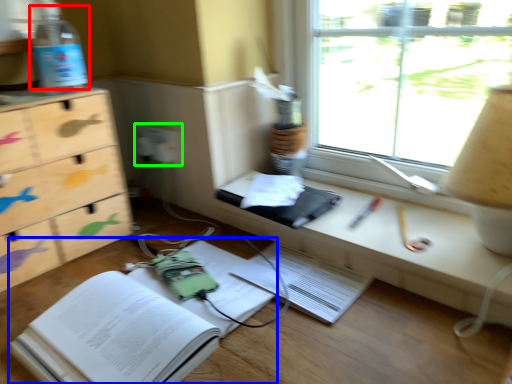
Question: Which object is the closest to the bottle (highlighted by a red box)? Choose among these: paperback book (highlighted by a blue box) or electric outlet (highlighted by a green box).

Choices:
 (A) paperback book
 (B) electric outlet

Answer: (B)